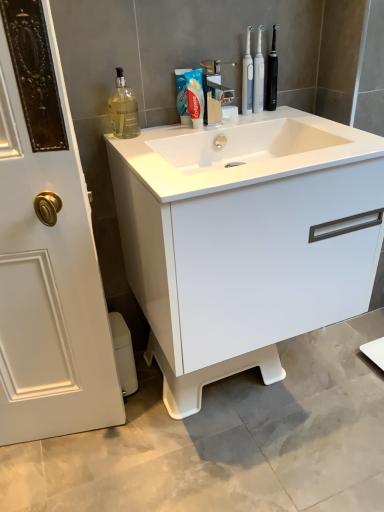
Find the location of a particular element. The image size is (384, 512). vacant space in front of translucent glass bottle at upper left is located at coordinates (129, 145).